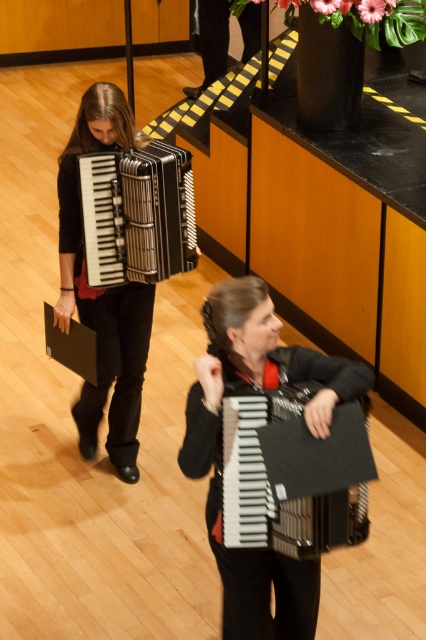
You are a photographer positioned at the front of the stage. You want to take a photo of both the matte black accordion at center and the metallic silver accordion at center. Which accordion will appear larger in your photo?

The matte black accordion at center will appear larger in the photo because it is closer to the viewer than the metallic silver accordion at center.

You are a stagehand setting up for a performance. You need to place a large music stand between the two accordions. Given that the matte black accordion at left is bigger than the metallic silver accordion at center, which side should you place the music stand closer to?

Since the matte black accordion at left is bigger than the metallic silver accordion at center, the music stand should be placed closer to the metallic silver accordion at center to ensure there is enough space between the two accordions.

You are a stagehand setting up for a performance. You need to place a microphone stand between the matte black accordion at left and the metallic silver accordion at center. Based on their positions, which side of the microphone stand should be closer to the stage entrance?

The microphone stand should be placed closer to the stage entrance on the side nearest the matte black accordion at left since it is positioned to the left of the metallic silver accordion at center.